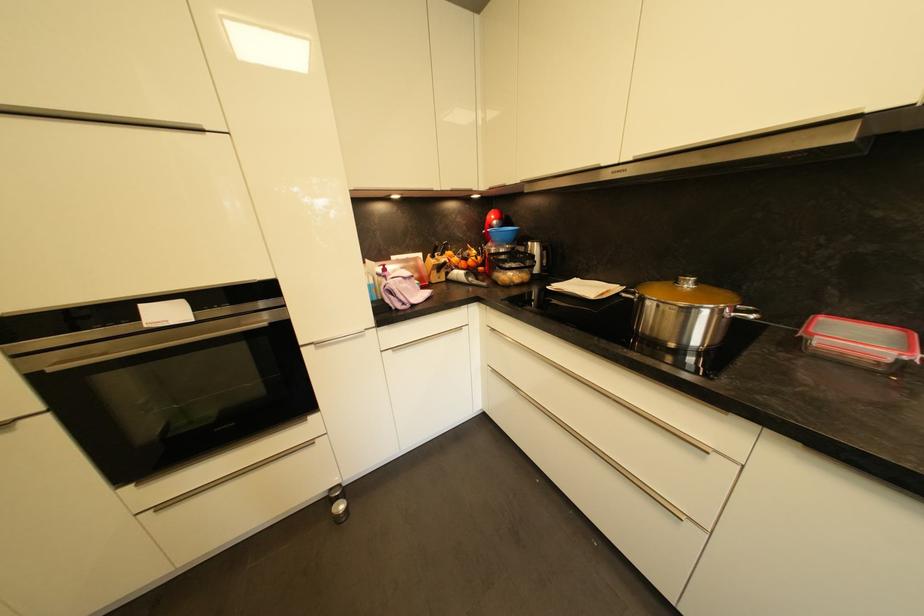
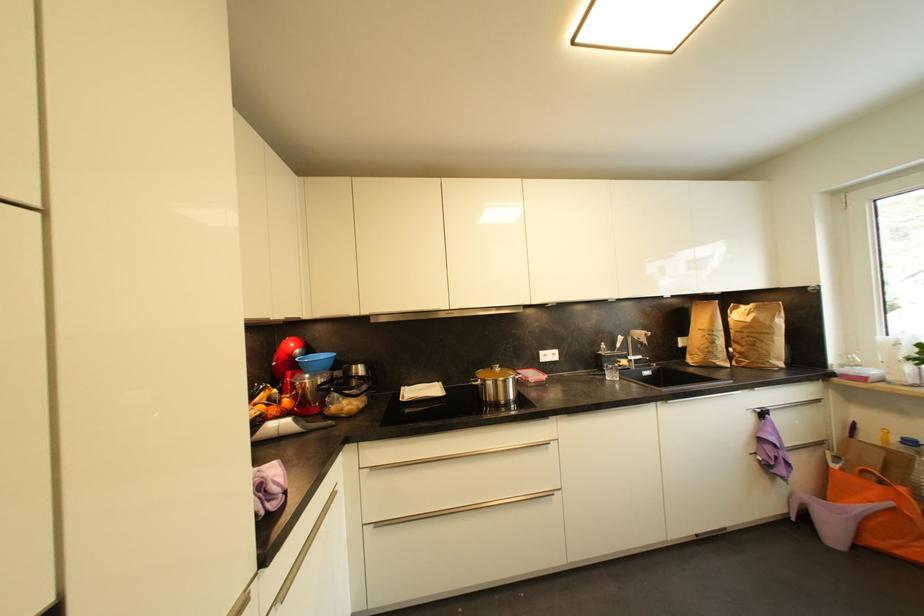
Find the pixel in the second image that matches point 468,265 in the first image.

(277, 411)